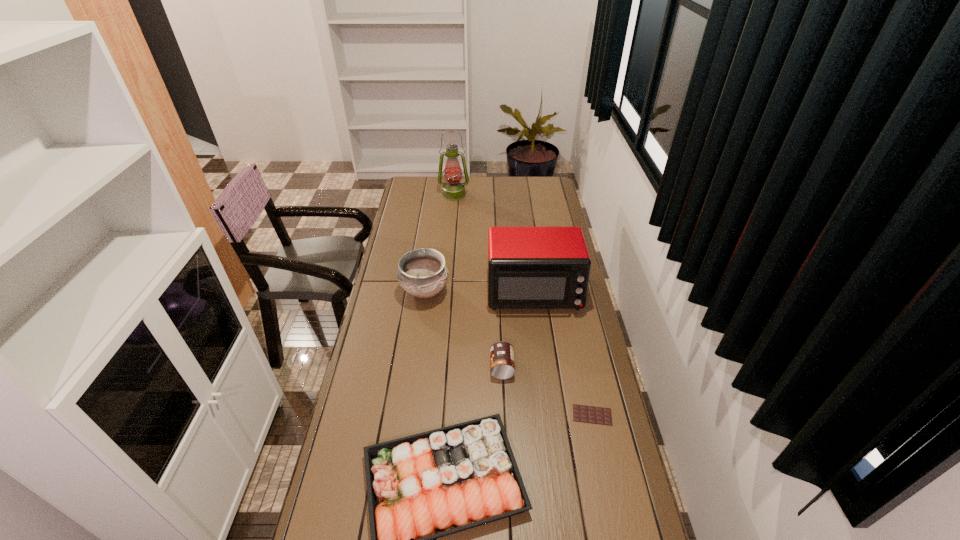
Where is `free space located on the front label of the third shortest object`? The image size is (960, 540). free space located on the front label of the third shortest object is located at coordinates (447, 367).

You are a GUI agent. You are given a task and a screenshot of the screen. Output one action in this format:
    pyautogui.click(x=<x>, y=<y>)
    Task: Click on the vacant space located on the front label of the third shortest object
    
    Given the screenshot: What is the action you would take?
    pyautogui.click(x=450, y=367)

Locate an element on the screen. free spot located on the front label of the third shortest object is located at coordinates (434, 367).

Where is `free point located on the back of the chocolate bar`? free point located on the back of the chocolate bar is located at coordinates (580, 359).

The image size is (960, 540). In order to click on object that is at the far edge in this screenshot , I will do `click(453, 190)`.

Where is `object that is at the left edge`? Image resolution: width=960 pixels, height=540 pixels. object that is at the left edge is located at coordinates (422, 272).

Where is `toaster oven located at the right edge`? toaster oven located at the right edge is located at coordinates (528, 267).

This screenshot has height=540, width=960. In order to click on chocolate bar at the right edge in this screenshot , I will do `click(589, 414)`.

Where is `free region at the far edge`? free region at the far edge is located at coordinates (516, 181).

I want to click on free space at the left edge, so click(x=361, y=449).